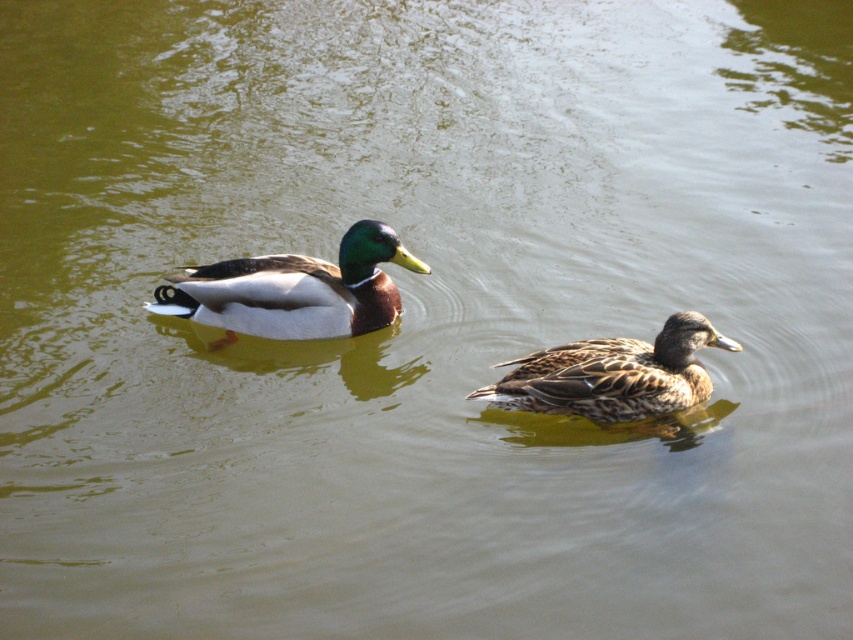
Question: Which point appears closest to the camera in this image?

Choices:
 (A) (372, 296)
 (B) (723, 337)

Answer: (B)

Question: Which of the following is the closest to the observer?

Choices:
 (A) (286, 316)
 (B) (637, 417)

Answer: (B)

Question: Among these objects, which one is nearest to the camera?

Choices:
 (A) brown speckled feathers at center
 (B) shiny brown duck at center

Answer: (A)

Question: Is shiny brown duck at center positioned in front of brown speckled feathers at center?

Choices:
 (A) no
 (B) yes

Answer: (A)

Question: Can you confirm if shiny brown duck at center is smaller than brown speckled feathers at center?

Choices:
 (A) yes
 (B) no

Answer: (B)

Question: Is shiny brown duck at center thinner than brown speckled feathers at center?

Choices:
 (A) yes
 (B) no

Answer: (B)